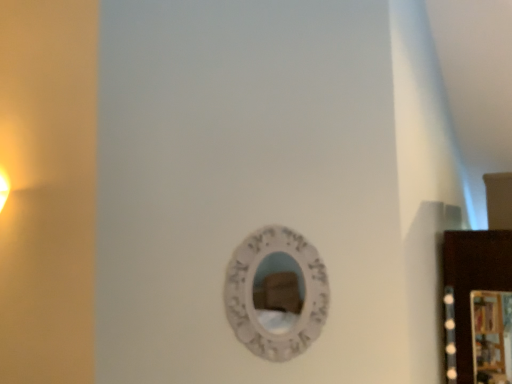
Question: Is wooden picture frame at right located outside white textured mirror at center?

Choices:
 (A) no
 (B) yes

Answer: (B)

Question: Would you say wooden picture frame at right is a long distance from white textured mirror at center?

Choices:
 (A) yes
 (B) no

Answer: (A)

Question: Is wooden picture frame at right thinner than white textured mirror at center?

Choices:
 (A) yes
 (B) no

Answer: (A)

Question: Does wooden picture frame at right turn towards white textured mirror at center?

Choices:
 (A) yes
 (B) no

Answer: (B)

Question: From the image's perspective, is wooden picture frame at right on top of white textured mirror at center?

Choices:
 (A) yes
 (B) no

Answer: (B)

Question: Is wooden picture frame at right to the right of white textured mirror at center from the viewer's perspective?

Choices:
 (A) yes
 (B) no

Answer: (A)

Question: Is white textured mirror at center taller than wooden picture frame at right?

Choices:
 (A) yes
 (B) no

Answer: (A)

Question: Could you tell me if white textured mirror at center is turned towards wooden picture frame at right?

Choices:
 (A) no
 (B) yes

Answer: (A)

Question: Considering the relative sizes of white textured mirror at center and wooden picture frame at right in the image provided, is white textured mirror at center thinner than wooden picture frame at right?

Choices:
 (A) yes
 (B) no

Answer: (B)

Question: From the image's perspective, would you say white textured mirror at center is shown under wooden picture frame at right?

Choices:
 (A) no
 (B) yes

Answer: (A)

Question: Is white textured mirror at center outside of wooden picture frame at right?

Choices:
 (A) no
 (B) yes

Answer: (B)

Question: Is white textured mirror at center shorter than wooden picture frame at right?

Choices:
 (A) no
 (B) yes

Answer: (A)

Question: From their relative heights in the image, would you say wooden picture frame at right is taller or shorter than white textured mirror at center?

Choices:
 (A) tall
 (B) short

Answer: (B)